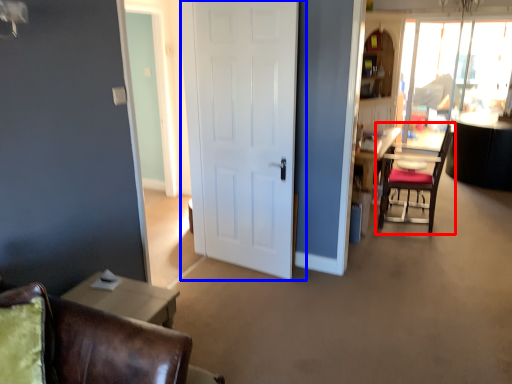
Question: Which point is closer to the camera, chair (highlighted by a red box) or door (highlighted by a blue box)?

Choices:
 (A) chair
 (B) door

Answer: (B)